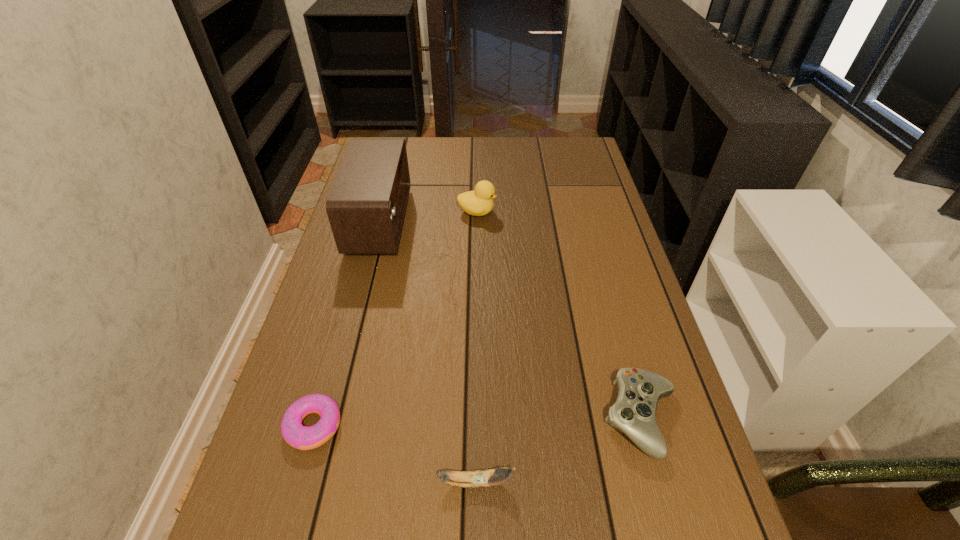
This screenshot has width=960, height=540. Identify the location of vacant region between the doughnut and the fourth shortest object. (396, 319).

Locate an element on the screen. The height and width of the screenshot is (540, 960). free spot between the doughnut and the banana is located at coordinates (395, 454).

Find the location of a particular element. The width and height of the screenshot is (960, 540). vacant area that lies between the rightmost object and the second tallest object is located at coordinates (559, 315).

What are the coordinates of `vacant region between the radio receiver and the shortest object` in the screenshot? It's located at (347, 324).

The height and width of the screenshot is (540, 960). I want to click on free area in between the doughnut and the radio receiver, so click(x=347, y=324).

The width and height of the screenshot is (960, 540). Find the location of `free space that is in between the rightmost object and the shortest object`. free space that is in between the rightmost object and the shortest object is located at coordinates (477, 422).

At what (x,y) coordinates should I click in order to perform the action: click on empty space between the banana and the shortest object. Please return your answer as a coordinate pair (x, y). This screenshot has height=540, width=960. Looking at the image, I should click on (395, 454).

Locate an element on the screen. free spot between the fourth shortest object and the tallest object is located at coordinates (428, 217).

Locate which object ranks in proximity to the radio receiver. Please provide its 2D coordinates. Your answer should be formatted as a tuple, i.e. [(x, y)], where the tuple contains the x and y coordinates of a point satisfying the conditions above.

[(479, 202)]

Locate an element on the screen. This screenshot has width=960, height=540. the closest object to the control is located at coordinates (480, 478).